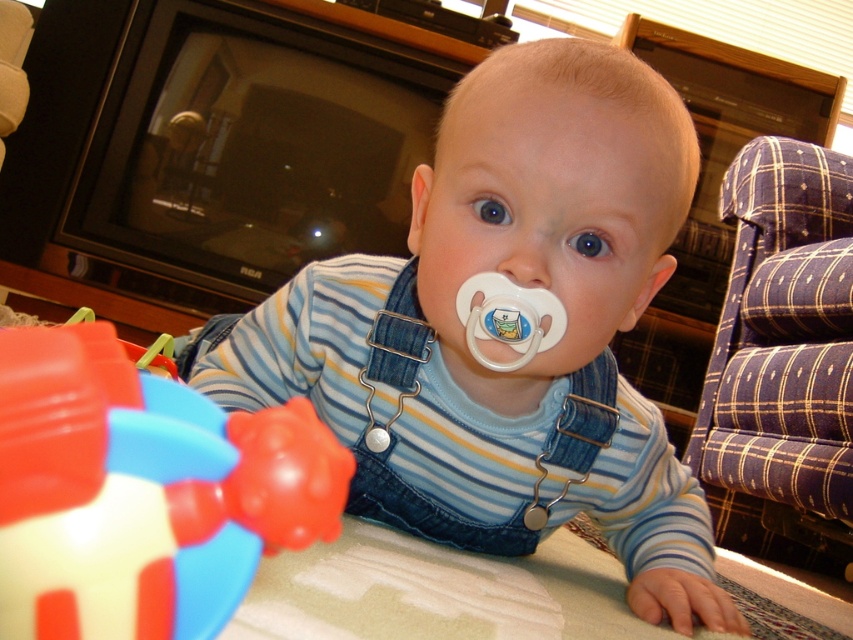
You are a photographer trying to focus on two points in the image. The first point is point (x=263, y=492) and the second is point (x=764, y=234). Which point is closer to the camera?

Point (x=263, y=492) is closer to the camera than point (x=764, y=234).

You are a parent trying to choose between the matte plastic pacifier at center and the rubberized plastic cube at lower left for your child. If you want the item with the larger width, which one should you choose?

The matte plastic pacifier at center has a larger width than the rubberized plastic cube at lower left, so you should choose the matte plastic pacifier at center.